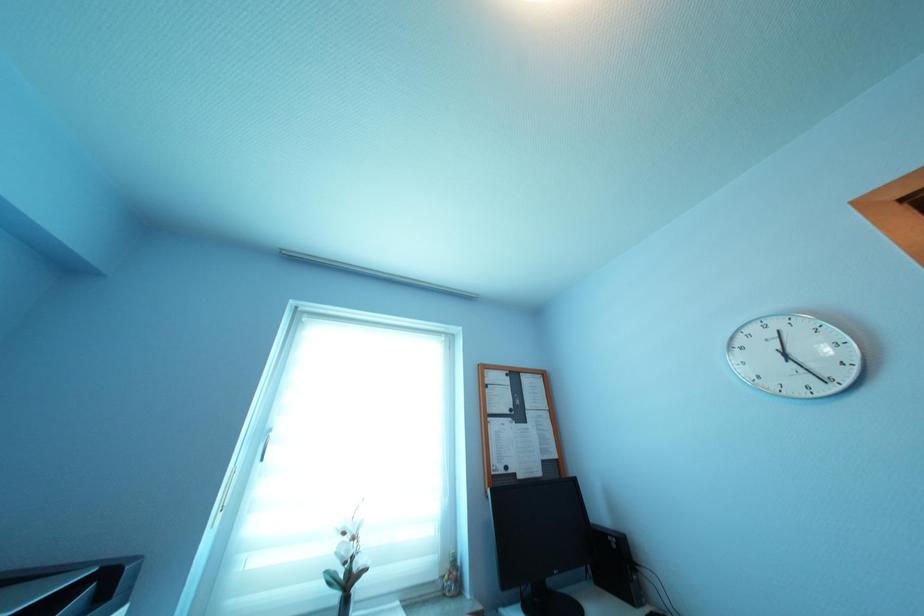
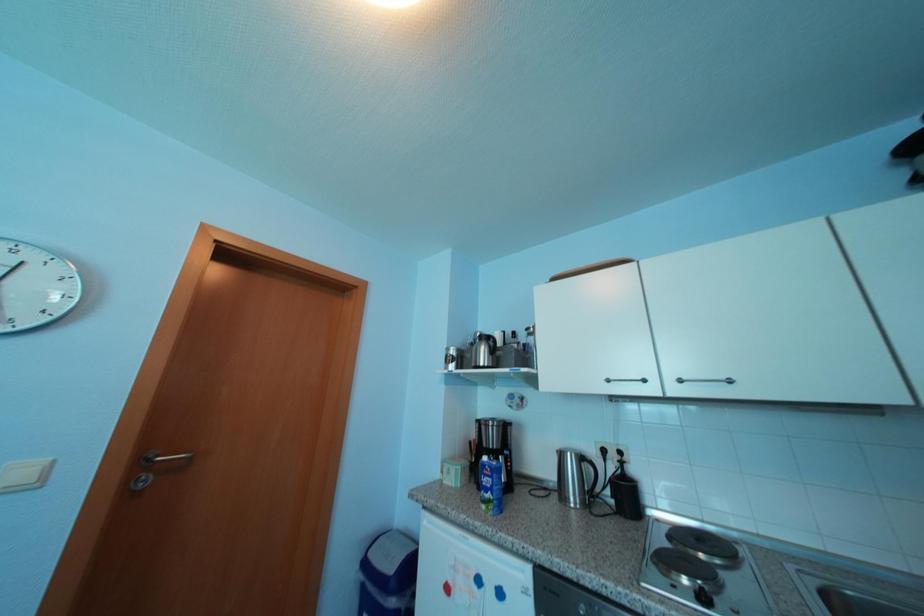
The images are taken continuously from a first-person perspective. In which direction is your viewpoint rotating?

The rotation direction of the camera is right-up.